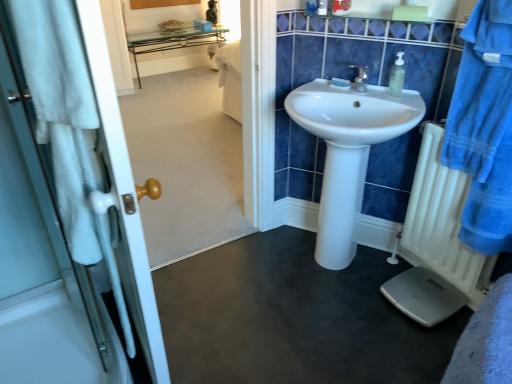
Question: Considering the positions of point (16, 130) and point (404, 225), is point (16, 130) closer or farther from the camera than point (404, 225)?

Choices:
 (A) farther
 (B) closer

Answer: (B)

Question: From a real-world perspective, is white glossy door handle at left positioned above or below white plastic radiator at right?

Choices:
 (A) below
 (B) above

Answer: (B)

Question: Which object is the closest to the smooth white scale at center?

Choices:
 (A) white glossy sink at center
 (B) white glossy door handle at left
 (C) clear plastic soap dispenser at upper right
 (D) transparent plastic soap at center
 (E) white plastic radiator at right

Answer: (E)

Question: Which is nearer to the transparent plastic soap at center?

Choices:
 (A) blue cotton bathrobe at right
 (B) white plastic radiator at right
 (C) smooth white scale at center
 (D) blue glossy tiles at upper center
 (E) white glossy sink at center

Answer: (D)